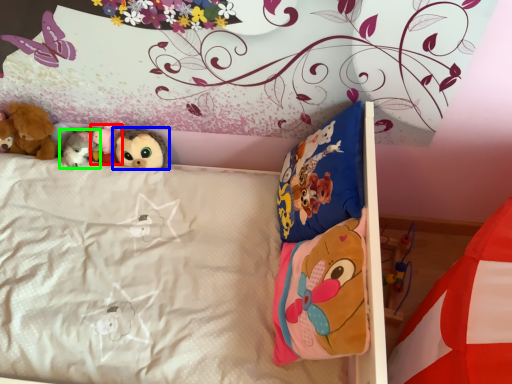
Question: Which object is positioned closest to toy (highlighted by a red box)? Select from toy (highlighted by a blue box) and toy (highlighted by a green box).

Choices:
 (A) toy
 (B) toy

Answer: (B)